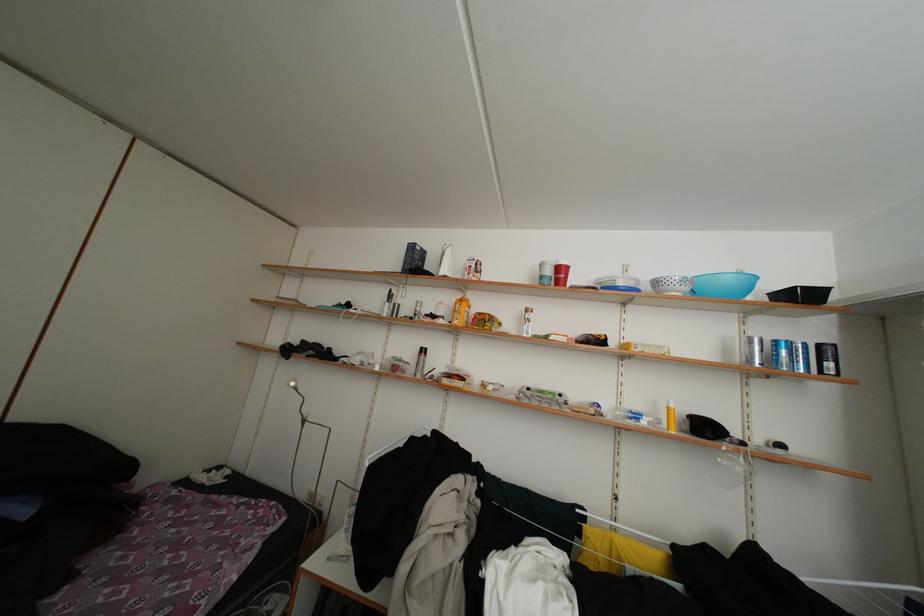
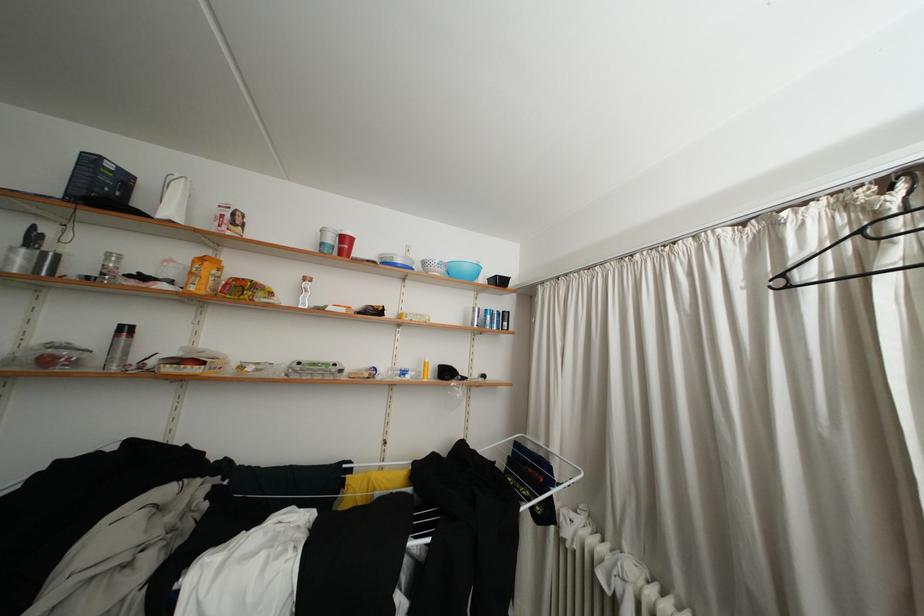
Locate, in the second image, the point that corresponds to point 550,283 in the first image.

(330, 249)